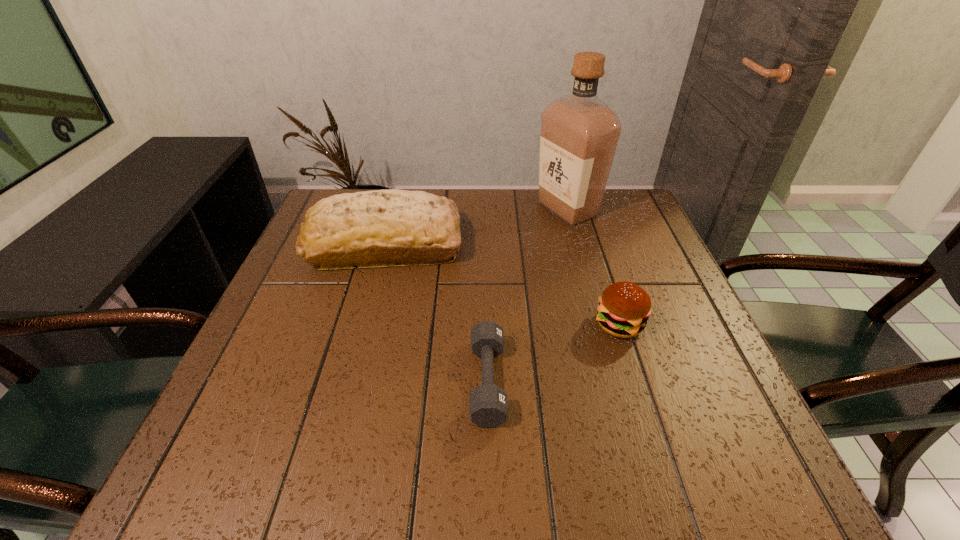
Identify the location of liquor. (579, 135).

You are a GUI agent. You are given a task and a screenshot of the screen. Output one action in this format:
    pyautogui.click(x=<x>, y=<y>)
    Task: Click on the second tallest object
    The height and width of the screenshot is (540, 960).
    Given the screenshot: What is the action you would take?
    pyautogui.click(x=380, y=228)

Find the location of a particular element. The width and height of the screenshot is (960, 540). the leftmost object is located at coordinates (380, 228).

In order to click on hamburger in this screenshot , I will do coord(624,307).

Where is `dumbbell`? dumbbell is located at coordinates (488, 406).

The height and width of the screenshot is (540, 960). I want to click on the third object from right to left, so click(488, 406).

Where is `free location located 0.400m on the front-facing side of the liquor`? free location located 0.400m on the front-facing side of the liquor is located at coordinates (393, 209).

The height and width of the screenshot is (540, 960). What are the coordinates of `free space located on the front-facing side of the liquor` in the screenshot? It's located at (499, 209).

This screenshot has height=540, width=960. Find the location of `vacant space located 0.200m on the front-facing side of the liquor`. vacant space located 0.200m on the front-facing side of the liquor is located at coordinates (464, 209).

The height and width of the screenshot is (540, 960). What are the coordinates of `free space located on the right of the leftmost object` in the screenshot? It's located at (491, 245).